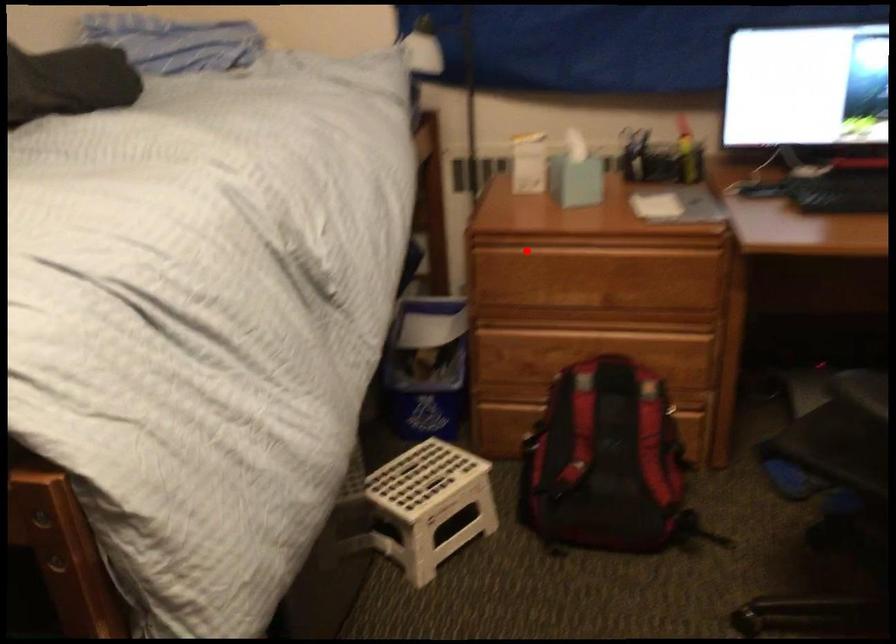
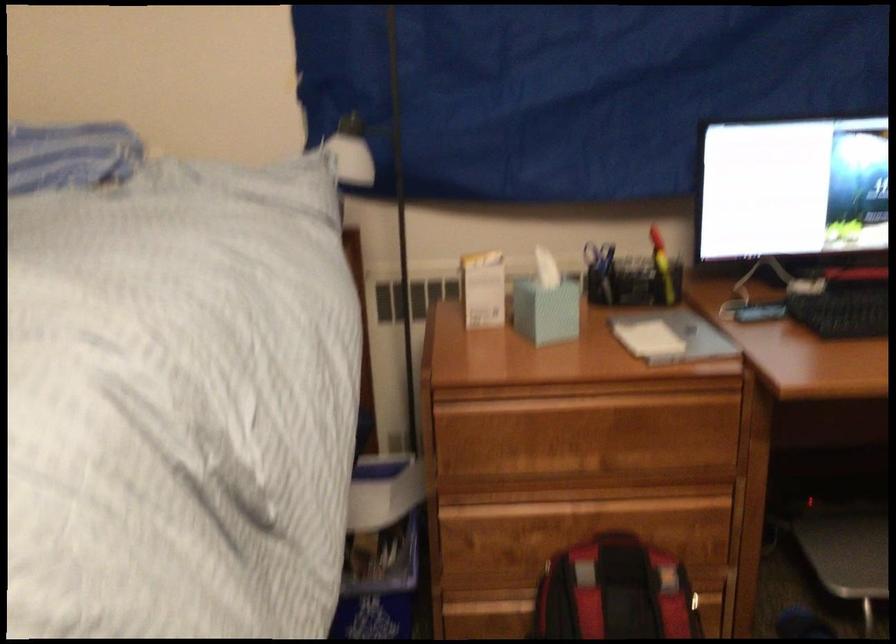
Question: I am providing you with two images of the same scene from different viewpoints. Given a red point in image1, look at the same physical point in image2. Is it:

Choices:
 (A) Closer to the viewpoint
 (B) Farther from the viewpoint

Answer: (A)